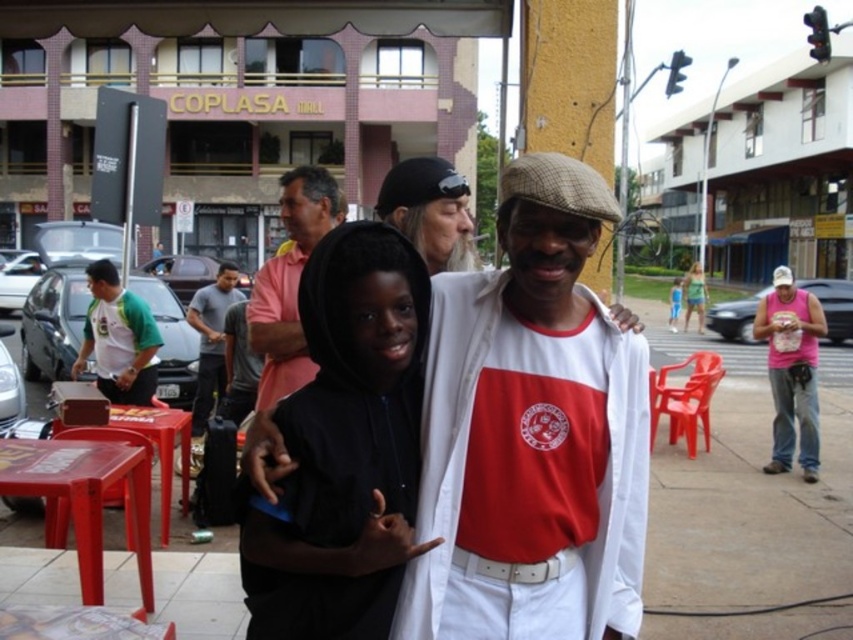
From the picture: Between white concrete pavement at center and gray cotton shirt at center, which one appears on the left side from the viewer's perspective?

From the viewer's perspective, gray cotton shirt at center appears more on the left side.

Who is more distant from viewer, (664,525) or (218,305)?

The point (218,305) is more distant.

Where is `white concrete pavement at center`? white concrete pavement at center is located at coordinates (747, 493).

Which is more to the left, pink sleeveless shirt at right or wooden stool at lower left?

wooden stool at lower left is more to the left.

Which is below, pink sleeveless shirt at right or wooden stool at lower left?

wooden stool at lower left is lower down.

Between point (776, 448) and point (170, 442), which one is positioned behind?

The point (776, 448) is more distant.

Identify the location of pink sleeveless shirt at right. The height and width of the screenshot is (640, 853). (791, 371).

Can you confirm if green fabric shorts at lower right is thinner than blue fabric shorts at lower right?

No.

Looking at this image, can you confirm if green fabric shorts at lower right is taller than blue fabric shorts at lower right?

Yes.

Between point (701, 308) and point (676, 308), which one is positioned behind?

The point (676, 308) is behind.

What are the coordinates of `green fabric shorts at lower right` in the screenshot? It's located at (694, 294).